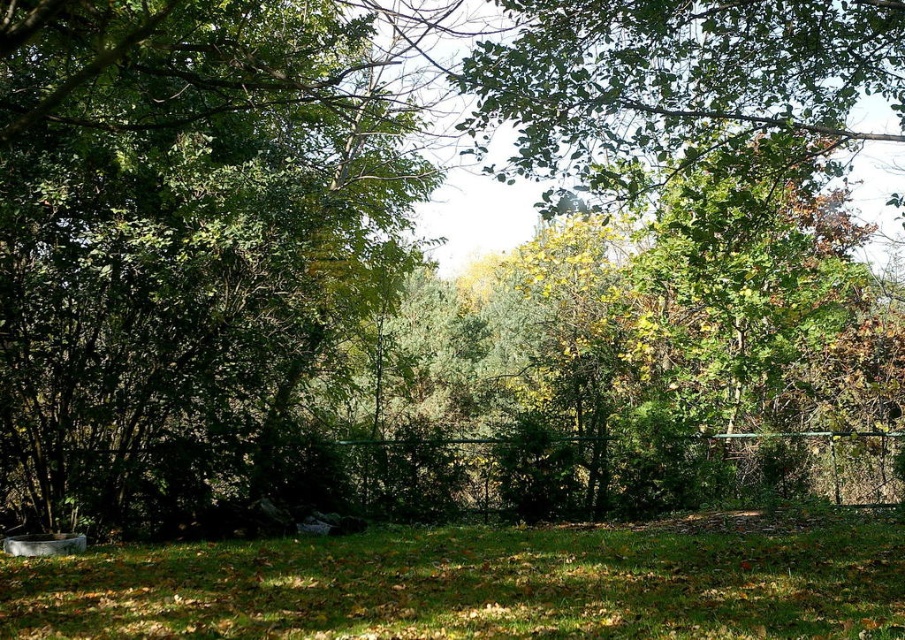
You are standing at the edge of the grassy area and want to walk towards the forest. Which object, the green grassy at lower center or the green metal fence at center, will you encounter first?

You will encounter the green metal fence at center first because it is closer to you than the green grassy at lower center, which is further away.